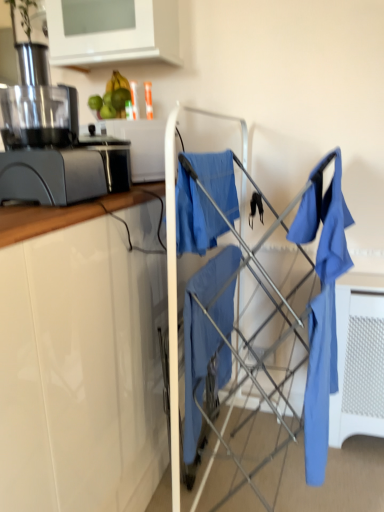
Question: Is matte blue fabric at center placed right next to white glossy cabinet at upper left?

Choices:
 (A) yes
 (B) no

Answer: (B)

Question: Is matte blue fabric at center behind white glossy cabinet at upper left?

Choices:
 (A) no
 (B) yes

Answer: (A)

Question: Does matte blue fabric at center lie in front of white glossy cabinet at upper left?

Choices:
 (A) yes
 (B) no

Answer: (A)

Question: Can we say matte blue fabric at center lies outside white glossy cabinet at upper left?

Choices:
 (A) no
 (B) yes

Answer: (B)

Question: Considering the relative sizes of matte blue fabric at center and white glossy cabinet at upper left in the image provided, is matte blue fabric at center thinner than white glossy cabinet at upper left?

Choices:
 (A) yes
 (B) no

Answer: (B)

Question: Looking at their shapes, would you say green matte avocado at upper center is wider or thinner than white glossy cabinet at upper left?

Choices:
 (A) thin
 (B) wide

Answer: (A)

Question: Do you think green matte avocado at upper center is within white glossy cabinet at upper left, or outside of it?

Choices:
 (A) inside
 (B) outside

Answer: (B)

Question: From a real-world perspective, is green matte avocado at upper center above or below white glossy cabinet at upper left?

Choices:
 (A) below
 (B) above

Answer: (A)

Question: Based on their sizes in the image, would you say green matte avocado at upper center is bigger or smaller than white glossy cabinet at upper left?

Choices:
 (A) small
 (B) big

Answer: (A)

Question: Visually, is matte blue fabric at center positioned to the left or to the right of blue fabric at center?

Choices:
 (A) right
 (B) left

Answer: (A)

Question: From a real-world perspective, is matte blue fabric at center physically located above or below blue fabric at center?

Choices:
 (A) above
 (B) below

Answer: (B)

Question: Considering the positions of matte blue fabric at center and blue fabric at center in the image, is matte blue fabric at center wider or thinner than blue fabric at center?

Choices:
 (A) wide
 (B) thin

Answer: (A)

Question: From their relative heights in the image, would you say matte blue fabric at center is taller or shorter than blue fabric at center?

Choices:
 (A) short
 (B) tall

Answer: (B)

Question: From the image's perspective, is white glossy cabinet at upper left above or below matte blue shirt at right?

Choices:
 (A) above
 (B) below

Answer: (A)

Question: In terms of height, does white glossy cabinet at upper left look taller or shorter compared to matte blue shirt at right?

Choices:
 (A) short
 (B) tall

Answer: (A)